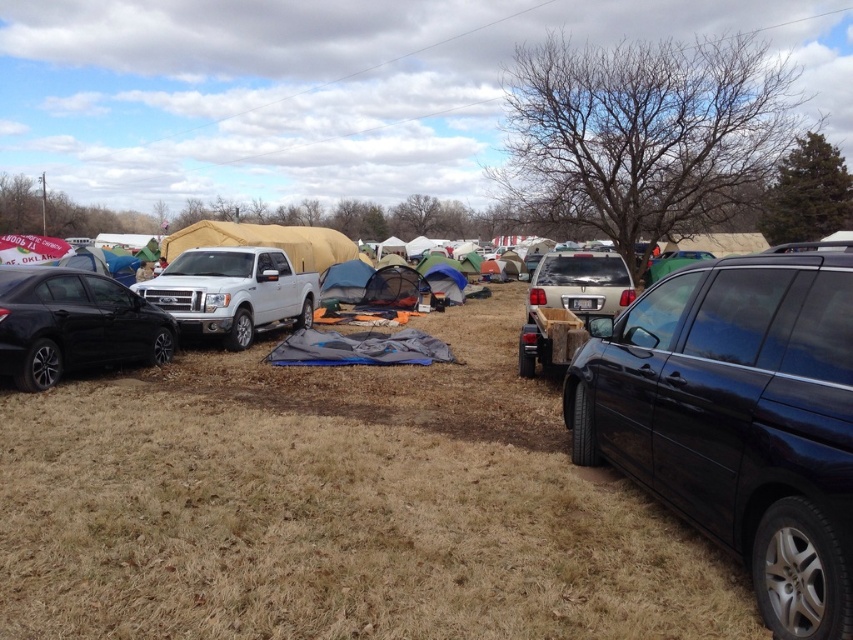
Is black matte minivan at right smaller than shiny black sedan at left?

Incorrect, black matte minivan at right is not smaller in size than shiny black sedan at left.

Does black matte minivan at right have a greater height compared to shiny black sedan at left?

Yes.

The width and height of the screenshot is (853, 640). Describe the element at coordinates (738, 417) in the screenshot. I see `black matte minivan at right` at that location.

I want to click on black matte minivan at right, so click(x=738, y=417).

Between brown grassy field at center and shiny black sedan at left, which one has less height?

brown grassy field at center is shorter.

Which is more to the left, brown grassy field at center or shiny black sedan at left?

shiny black sedan at left

Does point (308, 433) come closer to viewer compared to point (113, 342)?

That is True.

You are a GUI agent. You are given a task and a screenshot of the screen. Output one action in this format:
    pyautogui.click(x=<x>, y=<y>)
    Task: Click on the brown grassy field at center
    The image size is (853, 640).
    Given the screenshot: What is the action you would take?
    pyautogui.click(x=335, y=506)

What do you see at coordinates (738, 417) in the screenshot? I see `black matte minivan at right` at bounding box center [738, 417].

Does black matte minivan at right lie behind white matte truck at center?

No, black matte minivan at right is in front of white matte truck at center.

Who is more distant from viewer, (820, 326) or (236, 260)?

Point (236, 260)

I want to click on black matte minivan at right, so click(738, 417).